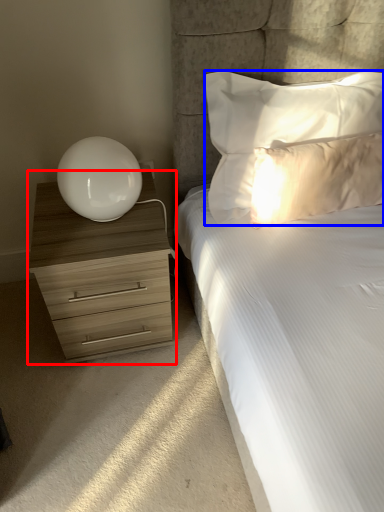
Question: Among these objects, which one is nearest to the camera, chest of drawers (highlighted by a red box) or pillow (highlighted by a blue box)?

Choices:
 (A) chest of drawers
 (B) pillow

Answer: (B)